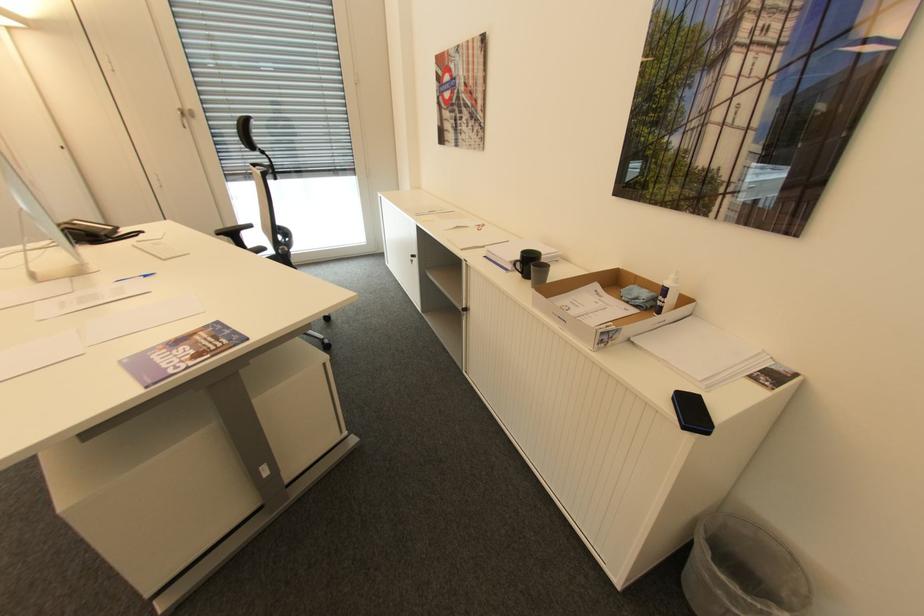
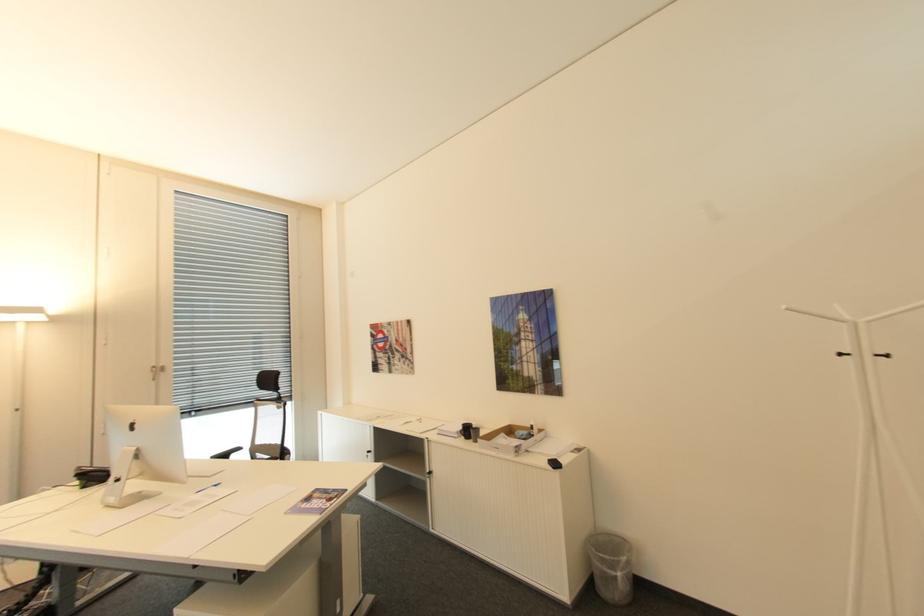
Question: I am providing you with two images of the same scene from different viewpoints. Which of the following objects are not visible in image2?

Choices:
 (A) mesh trash can
 (B) red plastic bucket
 (C) silver door handle
 (D) chair sitting surface

Answer: (D)